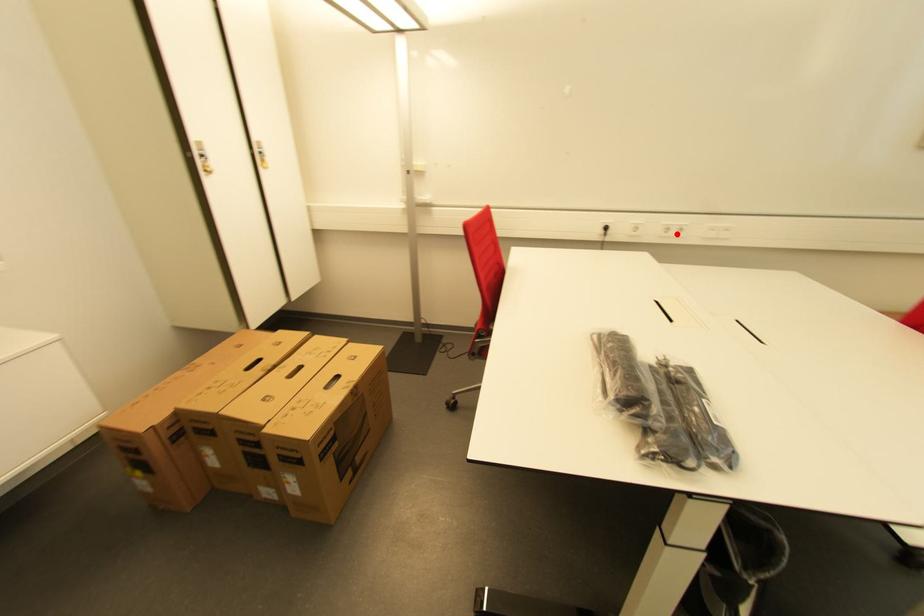
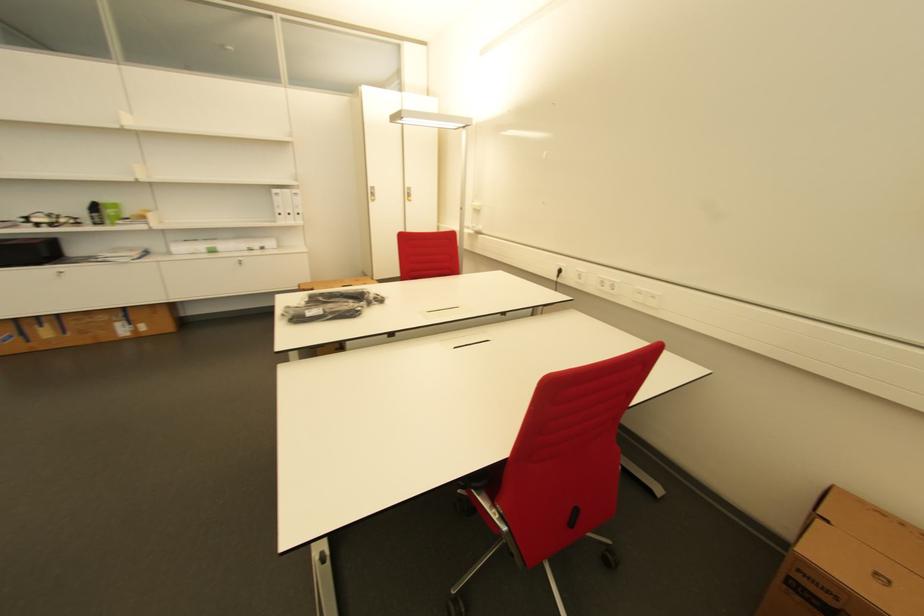
Locate, in the second image, the point that corresponds to the highlighted location in the first image.

(612, 289)